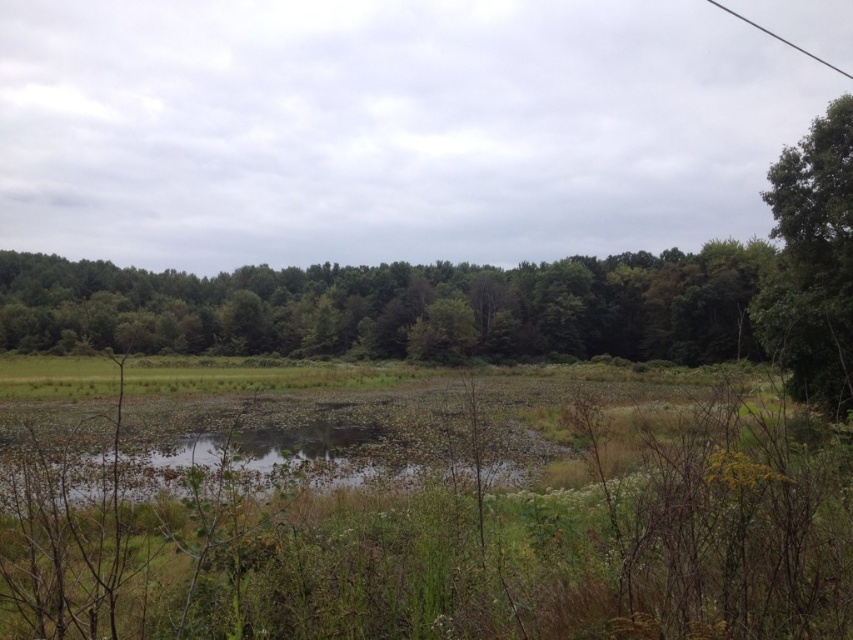
You are standing at the edge of the marshy area and want to take a photo of both the green leafy tree at center and the green grassy lake at center. Which object should you focus on first if you want to capture both in a single frame without moving the camera?

You should focus on the green leafy tree at center first because it is taller than the green grassy lake at center, so adjusting the focus to the tree ensures the lake will also be in the frame.

You are standing at the edge of the marshy area in the foreground of the image. You see a point marked at coordinates (398,307). Which object in the scene does this point belong to?

The point at coordinates (398,307) is on the green leafy tree at center.